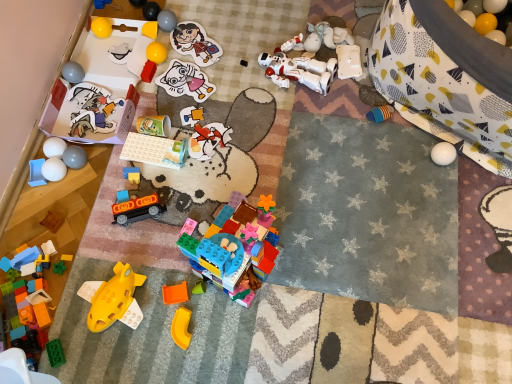
This screenshot has height=384, width=512. Find the location of `vacant space that is in between matte blue plastic toy at center, marked as the thirteenth toy in a right-to-left arrangement, and matte gray ball at upper center, arranged as the eighth toy when viewed from the right`. vacant space that is in between matte blue plastic toy at center, marked as the thirteenth toy in a right-to-left arrangement, and matte gray ball at upper center, arranged as the eighth toy when viewed from the right is located at coordinates (150, 106).